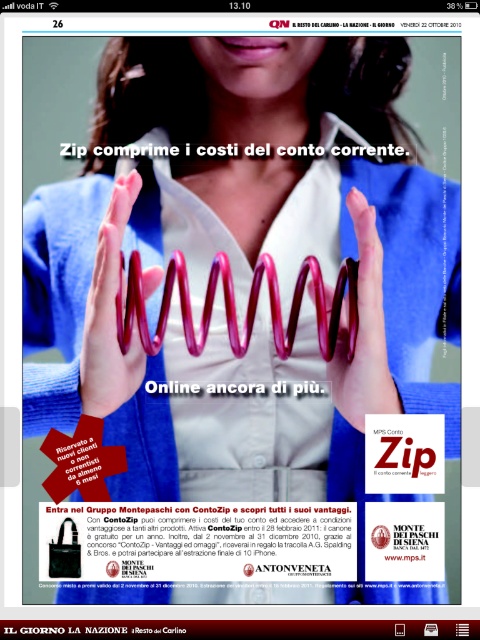
Question: Does white matte text at center come in front of matte black bag at lower left?

Choices:
 (A) yes
 (B) no

Answer: (A)

Question: Among these objects, which one is farthest from the camera?

Choices:
 (A) white matte text at center
 (B) matte white shirt at center
 (C) matte red spiral spring at center

Answer: (A)

Question: Which is farther from the white matte text at center?

Choices:
 (A) matte black bag at lower left
 (B) matte pink spiral at center
 (C) matte white shirt at center

Answer: (A)

Question: Is matte white shirt at center behind matte pink spiral at center?

Choices:
 (A) yes
 (B) no

Answer: (B)

Question: Which object is farther from the camera taking this photo?

Choices:
 (A) matte white shirt at center
 (B) matte red spiral spring at center
 (C) matte black bag at lower left

Answer: (C)

Question: Can you confirm if matte white shirt at center is smaller than matte black bag at lower left?

Choices:
 (A) no
 (B) yes

Answer: (A)